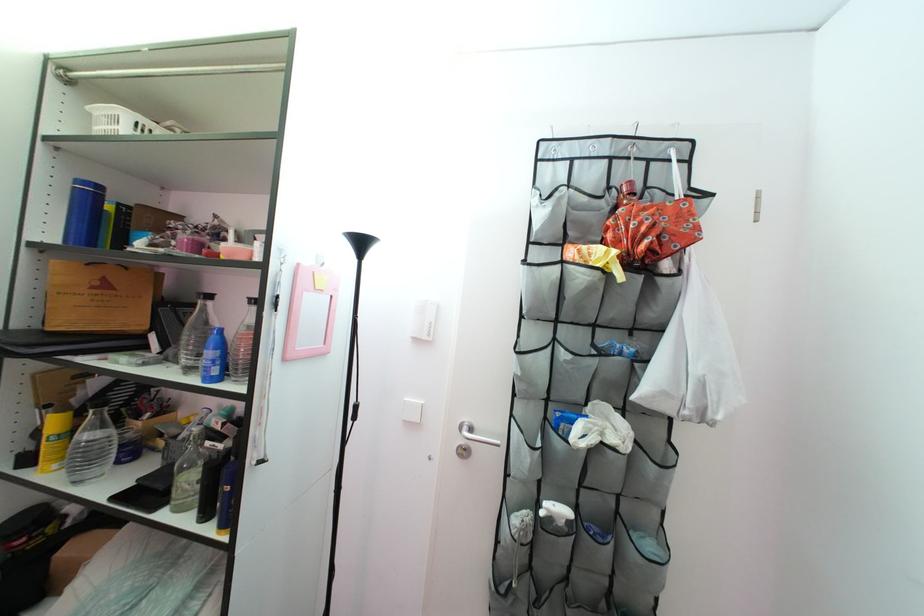
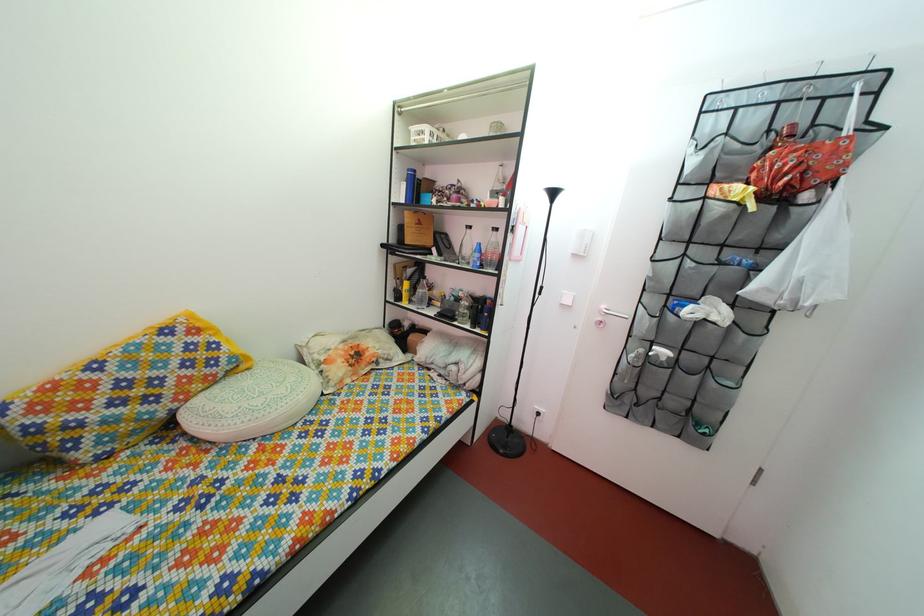
Question: Which direction would the cameraman need to move to produce the second image? Reply with the corresponding letter.

Choices:
 (A) Left
 (B) Right
 (C) Forward
 (D) Backward

Answer: (D)